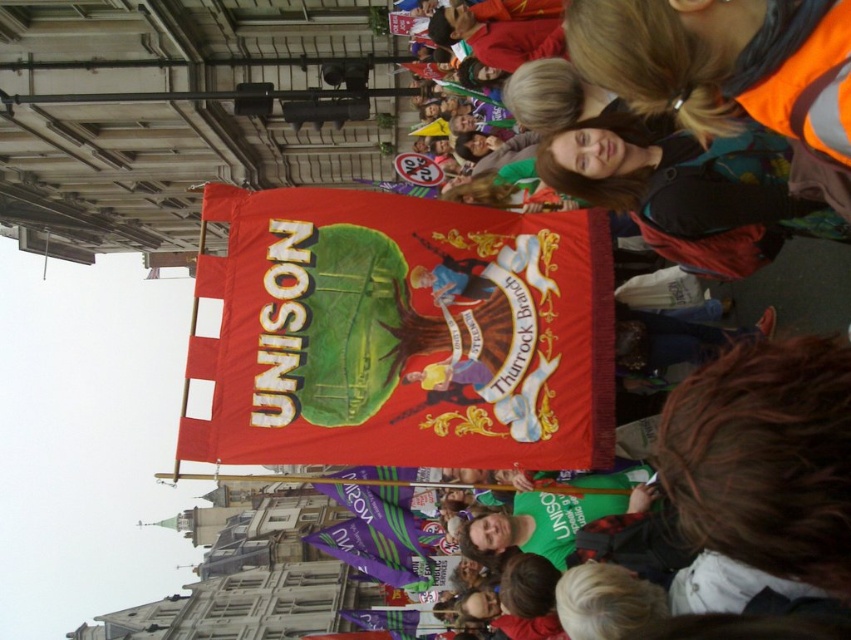
You are a photographer standing at the front of the protest scene. You want to take a photo that includes both the purple fabric flag at lower center and the purple fabric banner at center. What is the minimum distance you need to move backward to ensure both objects are in frame?

The purple fabric flag at lower center is 8.53 meters from the purple fabric banner at center. To capture both in a single frame, you need to move back at least 8.53 meters to ensure both are within the camera view.